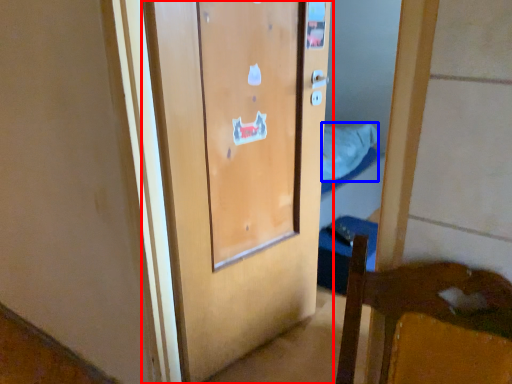
Question: Which object is further to the camera taking this photo, door (highlighted by a red box) or sheet (highlighted by a blue box)?

Choices:
 (A) door
 (B) sheet

Answer: (B)